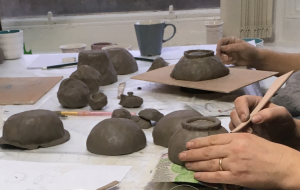
Locate an element on the screen. The width and height of the screenshot is (300, 190). table is located at coordinates (76, 168).